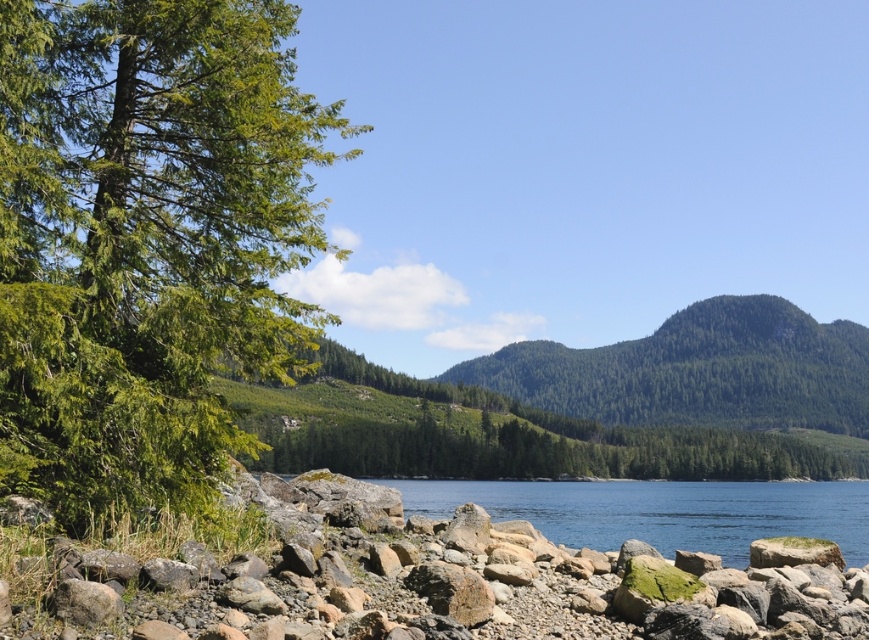
Based on the scene description, where is the green forested mountain at center located in the image?

The green forested mountain at center is located at point (697, 371) in the image.

You are standing on the rocky shoreline and looking towards the center of the image. Which object, the green forested mountain at center or the clear water at center, is higher in elevation?

The green forested mountain at center is taller than the clear water at center, so the green forested mountain at center is higher in elevation.

You are standing on the rocky shoreline and want to take a photo of both the green forested mountain at center and the clear water at center. Which object should you position closer to the left side of your camera frame to include both in the photo?

The clear water at center should be positioned closer to the left side of your camera frame because the green forested mountain at center is to the right of clear water at center.